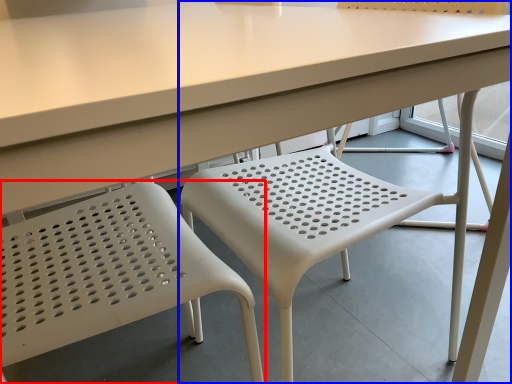
Question: Which object appears farthest to the camera in this image, chair (highlighted by a red box) or chair (highlighted by a blue box)?

Choices:
 (A) chair
 (B) chair

Answer: (B)